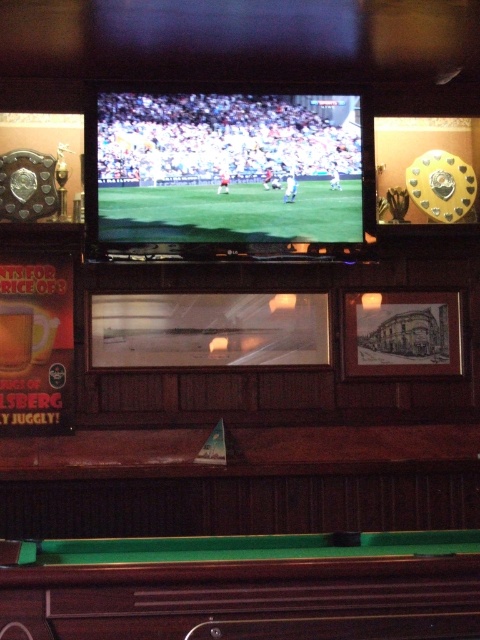
Can you confirm if green felt pool table at bottom is positioned above matte green screen at center?

No.

Is green felt pool table at bottom bigger than matte green screen at center?

Indeed, green felt pool table at bottom has a larger size compared to matte green screen at center.

Image resolution: width=480 pixels, height=640 pixels. What are the coordinates of `green felt pool table at bottom` in the screenshot? It's located at (247, 586).